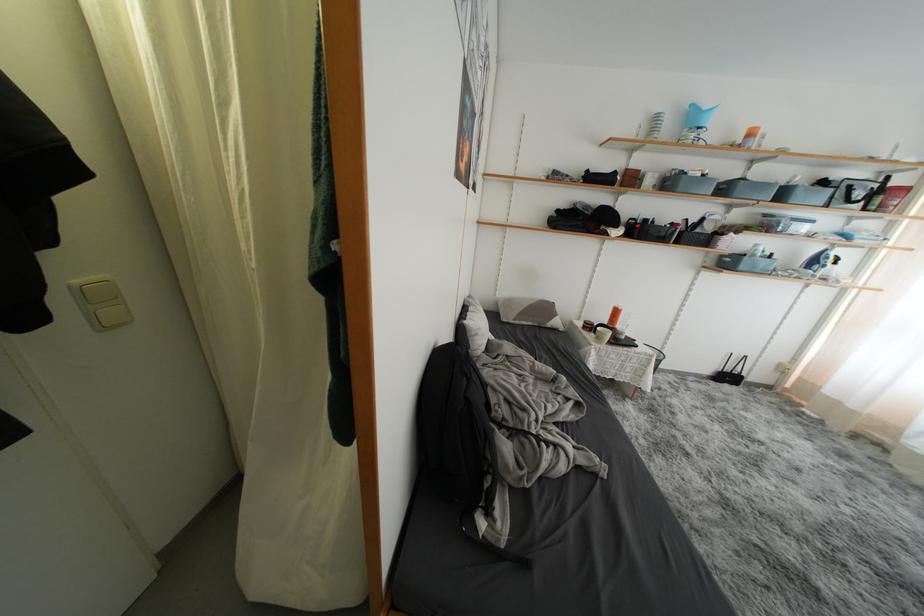
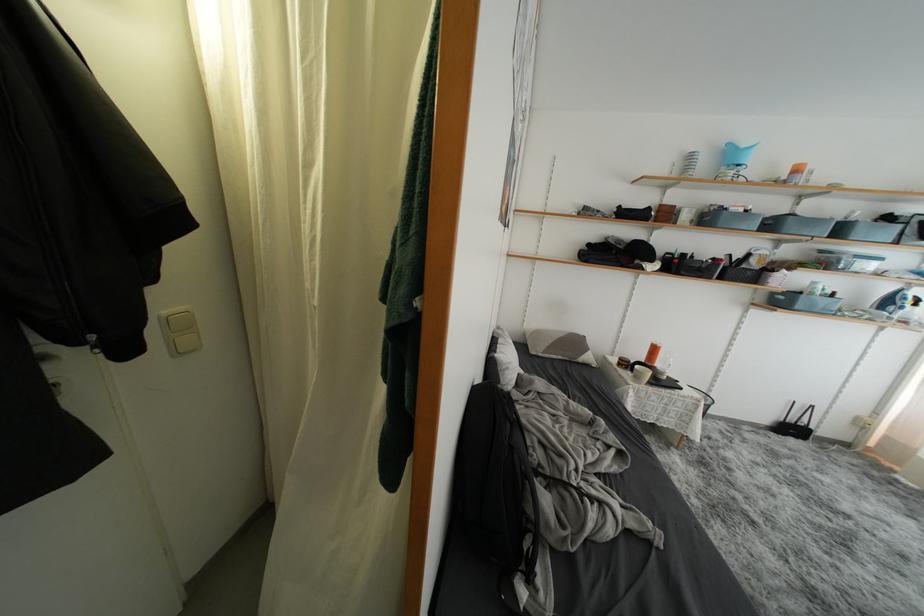
In the second image, find the point that corresponds to point (604, 342) in the first image.

(642, 382)